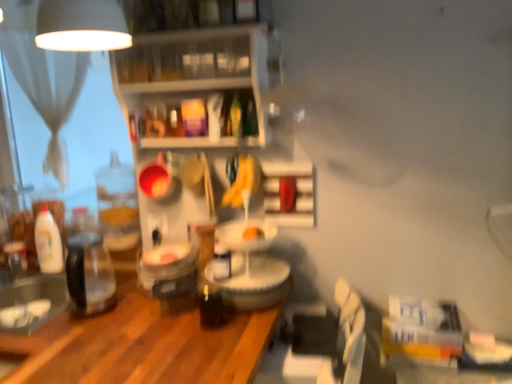
Where is `free space underneath clear glass jar at left (from a real-world perspective)`? free space underneath clear glass jar at left (from a real-world perspective) is located at coordinates (88, 311).